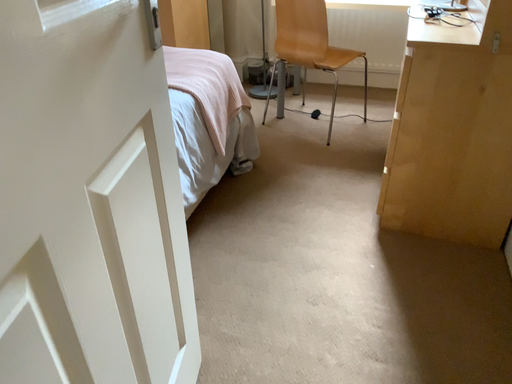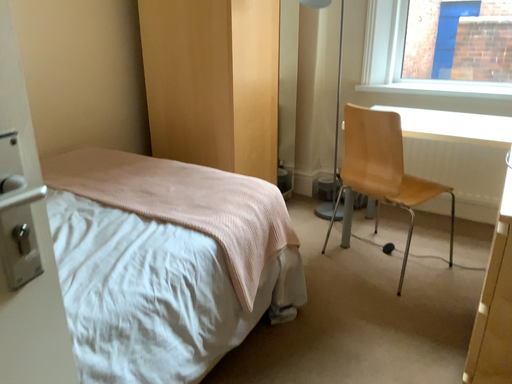
Question: Which way did the camera rotate in the video?

Choices:
 (A) rotated downward
 (B) rotated upward

Answer: (B)